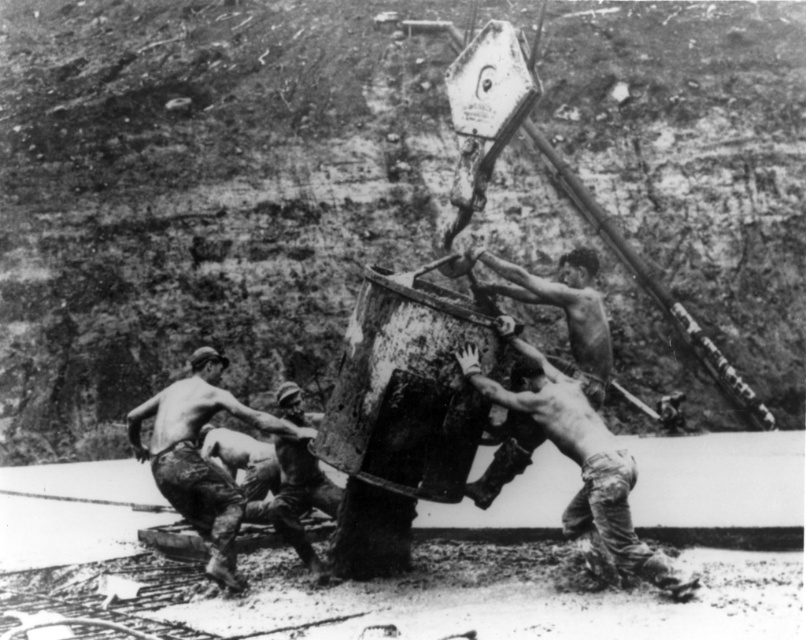
You are a safety inspector at the construction site. You notice the dirty skin man at lower left and the camouflage fabric pants at lower center. According to safety protocols, workers must maintain a minimum distance of 2 meters between each other to avoid accidents. Can you confirm if they are following this rule based on their positions?

The dirty skin man at lower left is positioned over camouflage fabric pants at lower center, which means they are too close to each other and not maintaining the required 2 meters distance. This violates safety protocols.

You are an observer standing at the edge of the construction site. You see the dirty skin man at center and the shiny metal chain at center. Which object is closer to you?

The dirty skin man at center is closer to you since he is in front of the shiny metal chain at center.